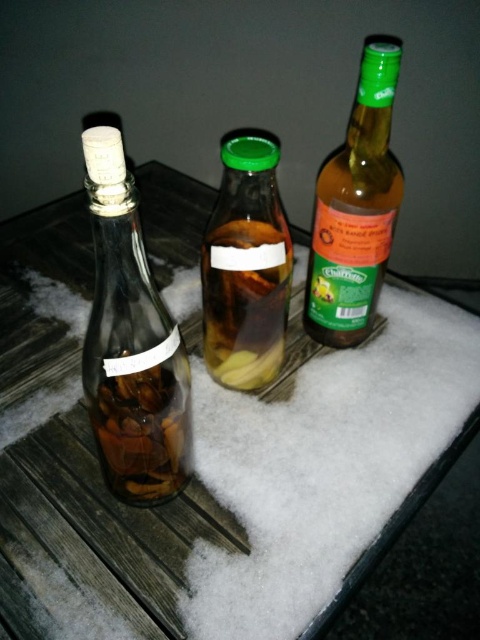
Between point (111, 259) and point (220, 244), which one is positioned in front?

Point (111, 259)

Between clear glass bottle at left and translucent glass bottle at center, which one appears on the left side from the viewer's perspective?

clear glass bottle at left is more to the left.

Locate an element on the screen. clear glass bottle at left is located at coordinates (131, 342).

Which of these two, clear glass bottle at left or green glass bottle at right, stands taller?

clear glass bottle at left

Does point (142, 353) come behind point (337, 150)?

No, it is in front of (337, 150).

Where is `clear glass bottle at left`? clear glass bottle at left is located at coordinates (131, 342).

What do you see at coordinates (356, 211) in the screenshot? I see `green glass bottle at right` at bounding box center [356, 211].

Is green glass bottle at right smaller than translucent glass bottle at center?

Yes.

Which is behind, point (310, 269) or point (217, 221)?

The point (310, 269) is more distant.

At what (x,y) coordinates should I click in order to perform the action: click on green glass bottle at right. Please return your answer as a coordinate pair (x, y). Looking at the image, I should click on (356, 211).